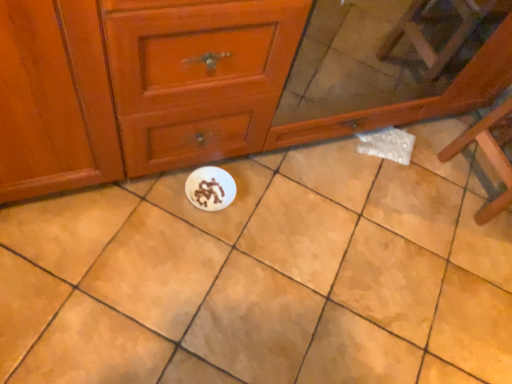
The height and width of the screenshot is (384, 512). What do you see at coordinates (265, 276) in the screenshot?
I see `white glossy plate at center` at bounding box center [265, 276].

Where is `white matte paper plate at center`? This screenshot has width=512, height=384. white matte paper plate at center is located at coordinates (210, 188).

Locate an element on the screen. Image resolution: width=512 pixels, height=384 pixels. wooden chair at right is located at coordinates [489, 154].

Considering the sizes of matte wood chest of drawers at center and white glossy plate at center in the image, is matte wood chest of drawers at center wider or thinner than white glossy plate at center?

matte wood chest of drawers at center is thinner than white glossy plate at center.

From the picture: Which is in front, matte wood chest of drawers at center or white glossy plate at center?

matte wood chest of drawers at center.

Based on their sizes in the image, would you say matte wood chest of drawers at center is bigger or smaller than white glossy plate at center?

matte wood chest of drawers at center is bigger than white glossy plate at center.

Is matte wood chest of drawers at center taller or shorter than white glossy plate at center?

Clearly, matte wood chest of drawers at center is taller compared to white glossy plate at center.

Is matte wood chest of drawers at center beside white matte paper plate at center?

No.

Is point (80, 177) closer or farther from the camera than point (215, 191)?

Point (80, 177).

Measure the distance between matte wood chest of drawers at center and white matte paper plate at center.

15.04 inches.

Which object is positioned more to the left, matte wood chest of drawers at center or white matte paper plate at center?

Positioned to the left is white matte paper plate at center.

From the picture: Which of these two, white matte paper plate at center or matte wood chest of drawers at center, is bigger?

With larger size is matte wood chest of drawers at center.

From a real-world perspective, is white matte paper plate at center over matte wood chest of drawers at center?

No.

Which is more distant, (211, 184) or (210, 36)?

The point (211, 184) is farther.

Do you think white matte paper plate at center is within white glossy plate at center, or outside of it?

white matte paper plate at center is enclosed within white glossy plate at center.

From a real-world perspective, relative to white glossy plate at center, is white matte paper plate at center vertically above or below?

Clearly, from a real-world perspective, white matte paper plate at center is above white glossy plate at center.

Considering the sizes of objects white matte paper plate at center and white glossy plate at center in the image provided, who is bigger, white matte paper plate at center or white glossy plate at center?

white glossy plate at center is bigger.

Looking at this image, from a real-world perspective, is white glossy plate at center beneath matte wood chest of drawers at center?

Indeed, from a real-world perspective, white glossy plate at center is positioned beneath matte wood chest of drawers at center.

Where is `ceramic tile behind the matte wood chest of drawers at center`? ceramic tile behind the matte wood chest of drawers at center is located at coordinates (265, 276).

Considering the positions of point (315, 315) and point (504, 104), is point (315, 315) closer or farther from the camera than point (504, 104)?

Point (315, 315).

How many degrees apart are the facing directions of white glossy plate at center and wooden chair at right?

They differ by 180 degrees in their facing directions.

Considering the positions of objects white glossy plate at center and wooden chair at right in the image provided, who is more to the right, white glossy plate at center or wooden chair at right?

wooden chair at right.

Is white glossy plate at center positioned in front of wooden chair at right?

Yes, the depth of white glossy plate at center is less than that of wooden chair at right.

Which object is positioned more to the right, white glossy plate at center or white matte paper plate at center?

white glossy plate at center.

From the picture: Is white glossy plate at center thinner than white matte paper plate at center?

No.

From the picture: Can white matte paper plate at center be found inside white glossy plate at center?

Yes, white glossy plate at center contains white matte paper plate at center.

Locate an element on the screen. ceramic tile that is under the matte wood chest of drawers at center (from a real-world perspective) is located at coordinates (265, 276).

Locate an element on the screen. paper plate behind the matte wood chest of drawers at center is located at coordinates (210, 188).

Which object lies further to the anchor point white glossy plate at center, matte wood chest of drawers at center or wooden chair at right?

wooden chair at right.

Based on their spatial positions, is white matte paper plate at center or white glossy plate at center closer to wooden chair at right?

white glossy plate at center is positioned closer to the anchor wooden chair at right.

From the image, which object appears to be farther from wooden chair at right, white matte paper plate at center or matte wood chest of drawers at center?

Based on the image, white matte paper plate at center appears to be further to wooden chair at right.

Which object lies nearer to the anchor point white matte paper plate at center, wooden chair at right or matte wood chest of drawers at center?

matte wood chest of drawers at center lies closer to white matte paper plate at center than the other object.

Looking at the image, which one is located closer to white matte paper plate at center, wooden chair at right or white glossy plate at center?

The object closer to white matte paper plate at center is white glossy plate at center.

Considering their positions, is wooden chair at right positioned closer to white glossy plate at center than white matte paper plate at center?

white matte paper plate at center is closer to white glossy plate at center.

Estimate the real-world distances between objects in this image. Which object is closer to wooden chair at right, matte wood chest of drawers at center or white matte paper plate at center?

matte wood chest of drawers at center lies closer to wooden chair at right than the other object.

Which object lies further to the anchor point white glossy plate at center, matte wood chest of drawers at center or white matte paper plate at center?

Based on the image, matte wood chest of drawers at center appears to be further to white glossy plate at center.

Identify the location of ceramic tile located between matte wood chest of drawers at center and wooden chair at right in the left-right direction. This screenshot has width=512, height=384. (265, 276).

Find the location of a particular element. ceramic tile positioned between matte wood chest of drawers at center and white matte paper plate at center from near to far is located at coordinates (265, 276).

Locate an element on the screen. The width and height of the screenshot is (512, 384). ceramic tile located between white matte paper plate at center and wooden chair at right in the left-right direction is located at coordinates (265, 276).

At what (x,y) coordinates should I click in order to perform the action: click on chest of drawers between white matte paper plate at center and wooden chair at right. Please return your answer as a coordinate pair (x, y). This screenshot has height=384, width=512. Looking at the image, I should click on (172, 88).